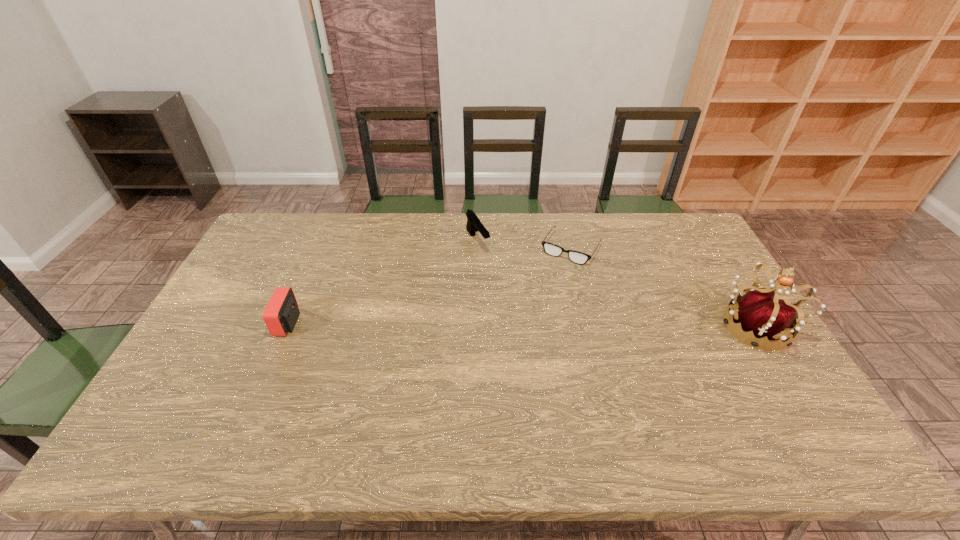
Locate an element on the screen. This screenshot has width=960, height=540. alarm clock is located at coordinates (281, 313).

Where is `the tallest object`? This screenshot has height=540, width=960. the tallest object is located at coordinates pyautogui.click(x=760, y=312).

Locate an element on the screen. The width and height of the screenshot is (960, 540). the rightmost object is located at coordinates (760, 312).

The height and width of the screenshot is (540, 960). Find the location of `the second object from right to left`. the second object from right to left is located at coordinates (580, 258).

You are a GUI agent. You are given a task and a screenshot of the screen. Output one action in this format:
    pyautogui.click(x=<x>, y=<y>)
    Task: Click on the shortest object
    This screenshot has height=540, width=960.
    Given the screenshot: What is the action you would take?
    pyautogui.click(x=580, y=258)

At what (x,y) coordinates should I click in order to perform the action: click on the second object from left to right. Please return your answer as a coordinate pair (x, y). The height and width of the screenshot is (540, 960). Looking at the image, I should click on (473, 225).

What are the coordinates of `free region located on the front-facing side of the leftmost object` in the screenshot? It's located at (213, 323).

Find the location of a particular element. The width and height of the screenshot is (960, 540). vacant space located on the front-facing side of the leftmost object is located at coordinates (247, 323).

This screenshot has width=960, height=540. I want to click on vacant space located on the front-facing side of the leftmost object, so click(205, 323).

This screenshot has width=960, height=540. I want to click on vacant space located 0.090m on the front-facing side of the third object from left to right, so click(x=550, y=281).